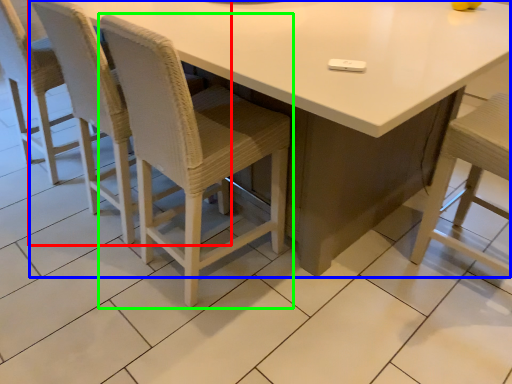
Question: Which object is positioned farthest from chair (highlighted by a red box)? Select from table (highlighted by a blue box) and chair (highlighted by a green box).

Choices:
 (A) table
 (B) chair

Answer: (A)